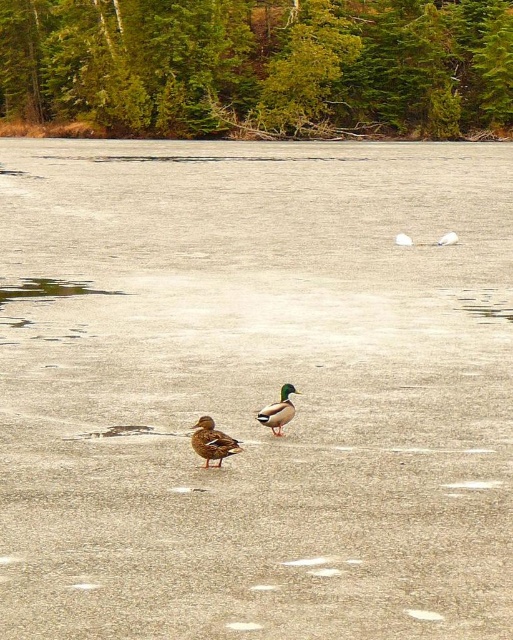
You are a wildlife photographer aiming to capture a closeup shot of the brown matte duck at center and the green matte duck at center. Given that your camera lens can focus on objects up to 2 meters away, can you determine if both ducks are within the focus range of your camera lens?

The brown matte duck at center is larger in size than green matte duck at center, but the description does not provide information about their distance from the camera. Therefore, it is impossible to determine if both ducks are within the 2 meter focus range of the camera lens based on the given information.

You are a birdwatcher observing the scene. You notice two ducks on the frozen lake. Which duck is positioned lower in the image, the brown matte duck at center or the green matte duck at center?

The brown matte duck at center is positioned below the green matte duck at center, so it is lower in the image.